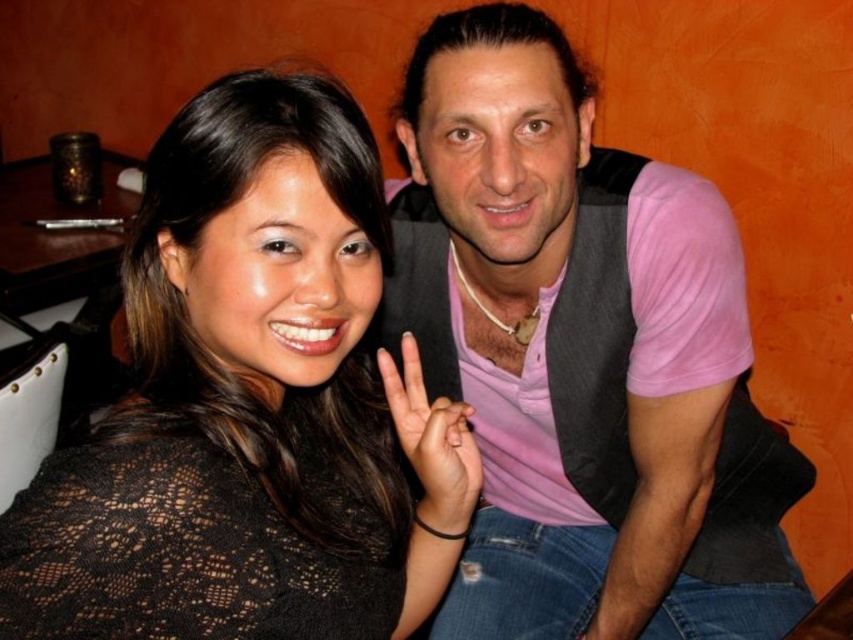
Question: Is black lace top at center wider than black lace hand at center?

Choices:
 (A) no
 (B) yes

Answer: (B)

Question: Does pink fabric vest at upper right appear under black lace hand at center?

Choices:
 (A) yes
 (B) no

Answer: (B)

Question: Which object is positioned farthest from the pink fabric vest at upper right?

Choices:
 (A) black lace hand at center
 (B) black lace top at center

Answer: (B)

Question: Does black lace top at center lie behind black lace hand at center?

Choices:
 (A) no
 (B) yes

Answer: (A)

Question: Considering the real-world distances, which object is farthest from the black lace hand at center?

Choices:
 (A) pink fabric vest at upper right
 (B) black lace top at center

Answer: (A)

Question: Which point appears closest to the camera in this image?

Choices:
 (A) (172, 134)
 (B) (593, 634)

Answer: (A)